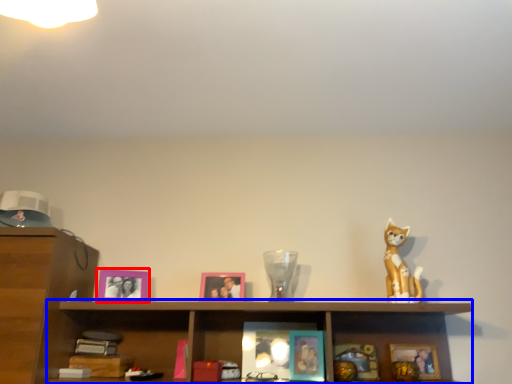
Question: Among these objects, which one is nearest to the camera, picture frame (highlighted by a red box) or cabinet (highlighted by a blue box)?

Choices:
 (A) picture frame
 (B) cabinet

Answer: (B)